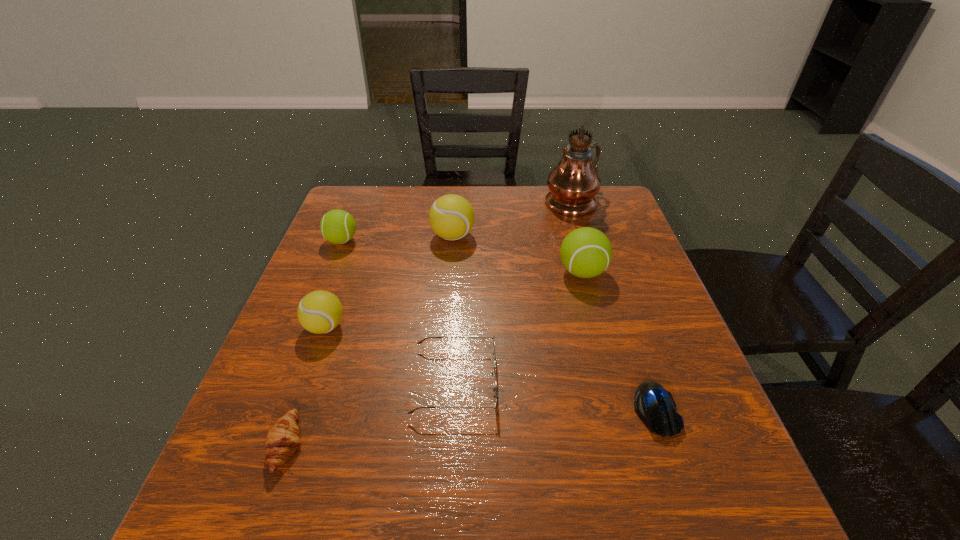
You are a GUI agent. You are given a task and a screenshot of the screen. Output one action in this format:
    pyautogui.click(x=<x>, y=<y>)
    Task: Click on the tallest object
    The image size is (960, 540).
    Given the screenshot: What is the action you would take?
    pyautogui.click(x=573, y=184)

The height and width of the screenshot is (540, 960). I want to click on the farthest object, so click(573, 184).

At what (x,y) coordinates should I click in order to perform the action: click on the farther yellow tennis ball. Please return your answer as a coordinate pair (x, y). The height and width of the screenshot is (540, 960). Looking at the image, I should click on (451, 217).

Where is `the second tennis ball from right to left`? The image size is (960, 540). the second tennis ball from right to left is located at coordinates (451, 217).

Image resolution: width=960 pixels, height=540 pixels. Find the location of `the third farthest tennis ball`. the third farthest tennis ball is located at coordinates (586, 252).

Image resolution: width=960 pixels, height=540 pixels. I want to click on the right green tennis ball, so click(x=586, y=252).

Locate an element on the screen. This screenshot has width=960, height=540. the farther green tennis ball is located at coordinates (337, 226).

The width and height of the screenshot is (960, 540). Find the location of `the smaller green tennis ball`. the smaller green tennis ball is located at coordinates (337, 226).

Where is `the smaller yellow tennis ball`? the smaller yellow tennis ball is located at coordinates (319, 312).

Where is `the left yellow tennis ball`? Image resolution: width=960 pixels, height=540 pixels. the left yellow tennis ball is located at coordinates (319, 312).